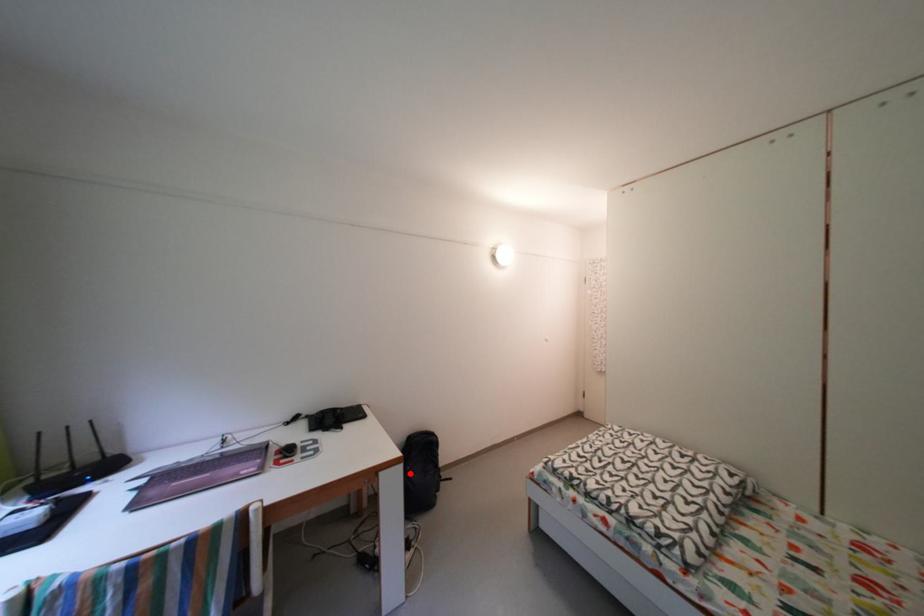
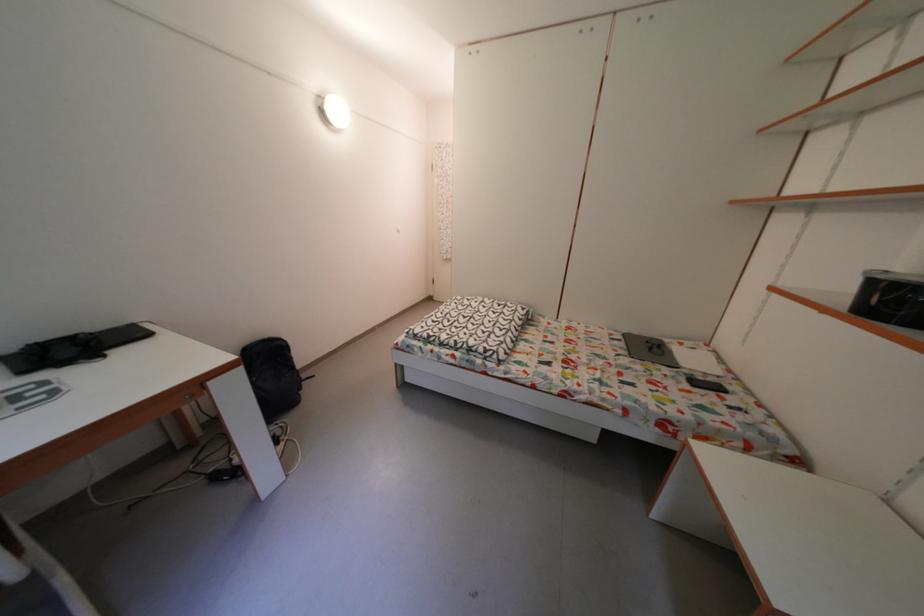
Question: I am providing you with two images of the same scene from different viewpoints. Given a red point in image1, look at the same physical point in image2. Is it:

Choices:
 (A) Closer to the viewpoint
 (B) Farther from the viewpoint

Answer: (A)